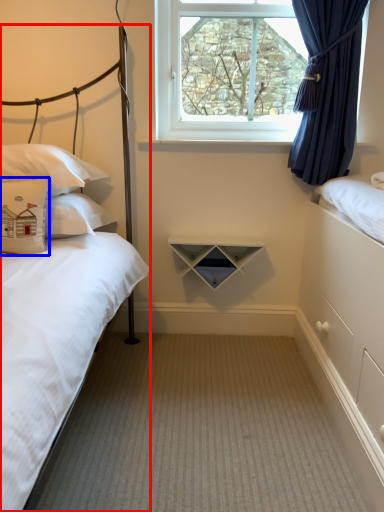
Question: Among these objects, which one is farthest to the camera, bed (highlighted by a red box) or pillow (highlighted by a blue box)?

Choices:
 (A) bed
 (B) pillow

Answer: (B)